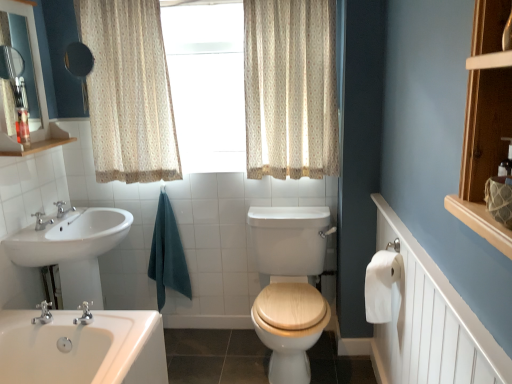
Identify the location of wooden shelf at upper right. This screenshot has width=512, height=384. (485, 123).

At what (x,y) coordinates should I click in order to perform the action: click on transparent glass window at center. Please return your answer as a coordinate pair (x, y). Looking at the image, I should click on (207, 83).

Locate an element on the screen. The width and height of the screenshot is (512, 384). white paper at right is located at coordinates (381, 285).

At what (x,y) coordinates should I click in order to perform the action: click on matte black mirror at upper left. Please return your answer as a coordinate pair (x, y). Looking at the image, I should click on (x=79, y=66).

This screenshot has height=384, width=512. What do you see at coordinates (431, 321) in the screenshot? I see `white textured radiator at right` at bounding box center [431, 321].

What do you see at coordinates (167, 254) in the screenshot? I see `teal cotton towel at center` at bounding box center [167, 254].

Where is `wooden shelf at upper right`? wooden shelf at upper right is located at coordinates (485, 123).

Which is in front, white textured radiator at right or brushed metal faucet at left, which is counted as the 3th tap, starting from the front?

white textured radiator at right.

From a real-world perspective, is white textured radiator at right physically located above or below brushed metal faucet at left, placed as the first tap when sorted from back to front?

From a real-world perspective, white textured radiator at right is physically below brushed metal faucet at left, placed as the first tap when sorted from back to front.

From the image's perspective, is white textured radiator at right above brushed metal faucet at left, acting as the 3th tap starting from the bottom?

Incorrect, from the image's perspective, white textured radiator at right is lower than brushed metal faucet at left, acting as the 3th tap starting from the bottom.

How different are the orientations of white textured radiator at right and brushed metal faucet at left, the first tap in the top-to-bottom sequence, in degrees?

They differ by 180 degrees in their facing directions.

Based on the photo, are matte black mirror at upper left and wooden shelf at upper right far apart?

Yes, matte black mirror at upper left and wooden shelf at upper right are located far from each other.

What are the coordinates of `mirror above the wooden shelf at upper right (from a real-world perspective)` in the screenshot? It's located at (79, 66).

Could you tell me if matte black mirror at upper left is facing wooden shelf at upper right?

No, matte black mirror at upper left is not turned towards wooden shelf at upper right.

Based on the photo, is matte black mirror at upper left not inside wooden shelf at upper right?

matte black mirror at upper left lies outside wooden shelf at upper right's area.

Is silver metallic faucet at lower left, positioned as the third tap in top-to-bottom order, positioned with its back to white glossy sink at lower left?

Absolutely, silver metallic faucet at lower left, positioned as the third tap in top-to-bottom order, is directed away from white glossy sink at lower left.

Considering the relative sizes of silver metallic faucet at lower left, which appears as the 3th tap when viewed from the back, and white glossy sink at lower left in the image provided, is silver metallic faucet at lower left, which appears as the 3th tap when viewed from the back, smaller than white glossy sink at lower left?

Indeed, silver metallic faucet at lower left, which appears as the 3th tap when viewed from the back, has a smaller size compared to white glossy sink at lower left.

Is point (46, 304) in front of point (59, 240)?

No, it is not.

I want to click on medicine cabinet lying in front of the brushed metal faucet at left, placed as the first tap when sorted from back to front, so click(34, 66).

Can you see matte black mirror at upper left touching brushed metal faucet at left, acting as the 3th tap starting from the bottom?

No, matte black mirror at upper left is not beside brushed metal faucet at left, acting as the 3th tap starting from the bottom.

Based on the photo, is matte black mirror at upper left wider or thinner than brushed metal faucet at left, the first tap in the top-to-bottom sequence?

Considering their sizes, matte black mirror at upper left looks broader than brushed metal faucet at left, the first tap in the top-to-bottom sequence.

Which point is more forward, [8,136] or [58,205]?

Positioned in front is point [8,136].

Does white glossy sink at lower left have a greater height compared to teal cotton towel at center?

No, white glossy sink at lower left is not taller than teal cotton towel at center.

Where is `sink on the left of teal cotton towel at center`? sink on the left of teal cotton towel at center is located at coordinates (73, 250).

Between point (42, 241) and point (180, 287), which one is positioned in front?

Point (42, 241)

Based on the photo, is white glossy sink at lower left turned away from teal cotton towel at center?

white glossy sink at lower left does not have its back to teal cotton towel at center.

Locate an element on the screen. The width and height of the screenshot is (512, 384). shelf in front of the brushed metal faucet at left, acting as the 3th tap starting from the bottom is located at coordinates (485, 123).

Is brushed metal faucet at left, placed as the first tap when sorted from back to front, oriented away from wooden shelf at upper right?

brushed metal faucet at left, placed as the first tap when sorted from back to front, is not turned away from wooden shelf at upper right.

Is brushed metal faucet at left, the first tap in the top-to-bottom sequence, directly adjacent to wooden shelf at upper right?

No, brushed metal faucet at left, the first tap in the top-to-bottom sequence, is not touching wooden shelf at upper right.

Could wooden shelf at upper right be considered to be inside brushed metal faucet at left, which is counted as the 3th tap, starting from the front?

No, wooden shelf at upper right is not inside brushed metal faucet at left, which is counted as the 3th tap, starting from the front.

Which of these two, white glossy sink at lower left or matte black mirror at upper left, is smaller?

matte black mirror at upper left is smaller.

Where is `sink on the right of the matte black mirror at upper left`? The height and width of the screenshot is (384, 512). sink on the right of the matte black mirror at upper left is located at coordinates (73, 250).

Considering the sizes of objects white glossy sink at lower left and matte black mirror at upper left in the image provided, who is wider, white glossy sink at lower left or matte black mirror at upper left?

white glossy sink at lower left.

Considering the points (93, 306) and (72, 70), which point is in front, point (93, 306) or point (72, 70)?

Positioned in front is point (93, 306).

Locate an element on the screen. radiator on the right side of brushed metal faucet at left, which is counted as the 3th tap, starting from the front is located at coordinates (431, 321).

This screenshot has width=512, height=384. Find the location of `mirror lying above the wooden shelf at upper right (from the image's perspective)`. mirror lying above the wooden shelf at upper right (from the image's perspective) is located at coordinates (79, 66).

Estimate the real-world distances between objects in this image. Which object is further from teal cotton towel at center, white textured radiator at right or brushed metal faucet at left, which ranks as the second tap in bottom-to-top order?

white textured radiator at right is further to teal cotton towel at center.

Looking at the image, which one is located further to silver metallic faucet at lower left, which appears as the 3th tap when viewed from the back, white textured radiator at right or beige floral fabric curtain at upper center, the second curtain when ordered from left to right?

beige floral fabric curtain at upper center, the second curtain when ordered from left to right, is positioned further to the anchor silver metallic faucet at lower left, which appears as the 3th tap when viewed from the back.

Based on their spatial positions, is transparent glass window at center or silver metallic faucet at lower left, positioned as the third tap in top-to-bottom order, further from teal cotton towel at center?

silver metallic faucet at lower left, positioned as the third tap in top-to-bottom order, is further to teal cotton towel at center.

Estimate the real-world distances between objects in this image. Which object is further from beige floral fabric curtain at upper center, the 2th curtain in the right-to-left sequence, white textured radiator at right or white paper at right?

white textured radiator at right.

From the image, which object appears to be nearer to brushed metal faucet at left, which ranks as the second tap in bottom-to-top order, white textured radiator at right or beige floral fabric curtain at upper center, which is the first curtain from right to left?

beige floral fabric curtain at upper center, which is the first curtain from right to left.

Considering their positions, is white glossy sink at lower left positioned closer to white paper at right than beige floral fabric curtain at upper center, the second curtain when ordered from left to right?

Based on the image, beige floral fabric curtain at upper center, the second curtain when ordered from left to right, appears to be nearer to white paper at right.

Considering their positions, is white glossy shelf at upper left positioned closer to beige floral fabric curtain at upper center, the second curtain when ordered from left to right, than brushed metal faucet at left, marked as the second tap in a top-to-bottom arrangement?

The object closer to beige floral fabric curtain at upper center, the second curtain when ordered from left to right, is white glossy shelf at upper left.

From the image, which object appears to be farther from white glossy shelf at upper left, beige floral fabric curtain at upper center, the 2th curtain in the right-to-left sequence, or brushed metal faucet at left, the first tap in the top-to-bottom sequence?

beige floral fabric curtain at upper center, the 2th curtain in the right-to-left sequence.

Find the location of a particular element. mirror between wooden shelf at upper right and teal cotton towel at center in the front-back direction is located at coordinates (79, 66).

I want to click on shelf between silver metallic faucet at lower left, the 1th tap when ordered from front to back, and white textured radiator at right, in the horizontal direction, so click(485, 123).

Where is `toilet paper situated between matte black mirror at upper left and white textured radiator at right from left to right`? toilet paper situated between matte black mirror at upper left and white textured radiator at right from left to right is located at coordinates (381, 285).

This screenshot has width=512, height=384. Identify the location of sink that lies between matte black mirror at upper left and silver metallic faucet at lower left, which appears as the 1th tap when ordered from the bottom, from top to bottom. (73, 250).